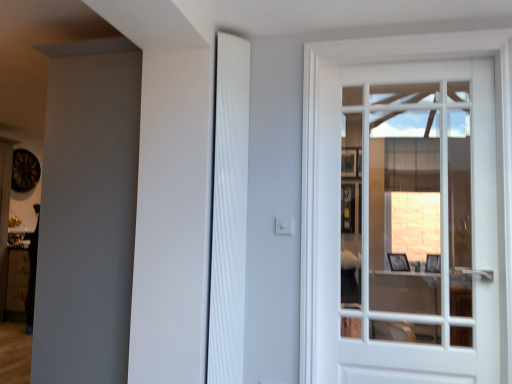
Question: Can you confirm if white ribbed shutter at center is positioned to the right of white glass door at right?

Choices:
 (A) yes
 (B) no

Answer: (B)

Question: From the image's perspective, is white ribbed shutter at center located beneath white glass door at right?

Choices:
 (A) no
 (B) yes

Answer: (A)

Question: From the image's perspective, is white ribbed shutter at center on top of white glass door at right?

Choices:
 (A) yes
 (B) no

Answer: (A)

Question: Is white ribbed shutter at center taller than white glass door at right?

Choices:
 (A) yes
 (B) no

Answer: (A)

Question: Does white ribbed shutter at center have a greater width compared to white glass door at right?

Choices:
 (A) yes
 (B) no

Answer: (B)

Question: Is white ribbed shutter at center aimed at white glass door at right?

Choices:
 (A) no
 (B) yes

Answer: (A)

Question: Is white glass door at right positioned in front of white ribbed shutter at center?

Choices:
 (A) no
 (B) yes

Answer: (B)

Question: Does white glass door at right appear on the right side of white ribbed shutter at center?

Choices:
 (A) no
 (B) yes

Answer: (B)

Question: Is white glass door at right thinner than white ribbed shutter at center?

Choices:
 (A) no
 (B) yes

Answer: (A)

Question: Would you say white glass door at right contains white ribbed shutter at center?

Choices:
 (A) no
 (B) yes

Answer: (A)

Question: Is white glass door at right taller than white ribbed shutter at center?

Choices:
 (A) no
 (B) yes

Answer: (A)

Question: From a real-world perspective, is white glass door at right located beneath white ribbed shutter at center?

Choices:
 (A) no
 (B) yes

Answer: (B)

Question: From the image's perspective, is white glass door at right positioned above or below white ribbed shutter at center?

Choices:
 (A) below
 (B) above

Answer: (A)